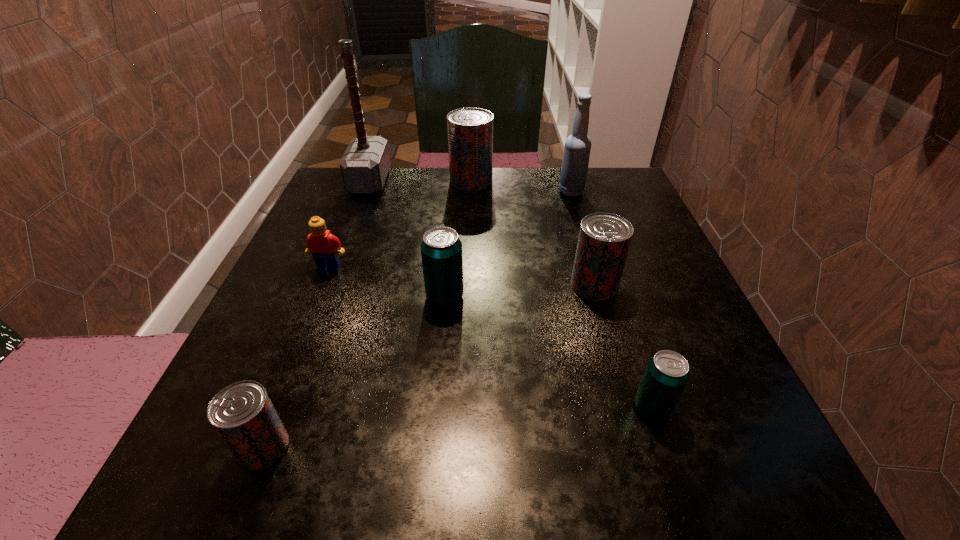
Identify the location of the tallest object. (365, 164).

The height and width of the screenshot is (540, 960). Find the location of `hammer`. hammer is located at coordinates (365, 164).

Image resolution: width=960 pixels, height=540 pixels. I want to click on the second tallest object, so click(577, 148).

Where is `the tallest beer can`? the tallest beer can is located at coordinates (470, 130).

The image size is (960, 540). In order to click on the farthest beer can in this screenshot , I will do `click(470, 130)`.

Find the location of a particular element. The height and width of the screenshot is (540, 960). the farther teal beer can is located at coordinates (441, 250).

This screenshot has width=960, height=540. Identify the location of the bigger teal beer can. (441, 250).

Where is `the second farthest red beer can`? The height and width of the screenshot is (540, 960). the second farthest red beer can is located at coordinates (604, 239).

Identify the location of the second biggest red beer can. (604, 239).

The height and width of the screenshot is (540, 960). Identify the location of Lego. tap(322, 245).